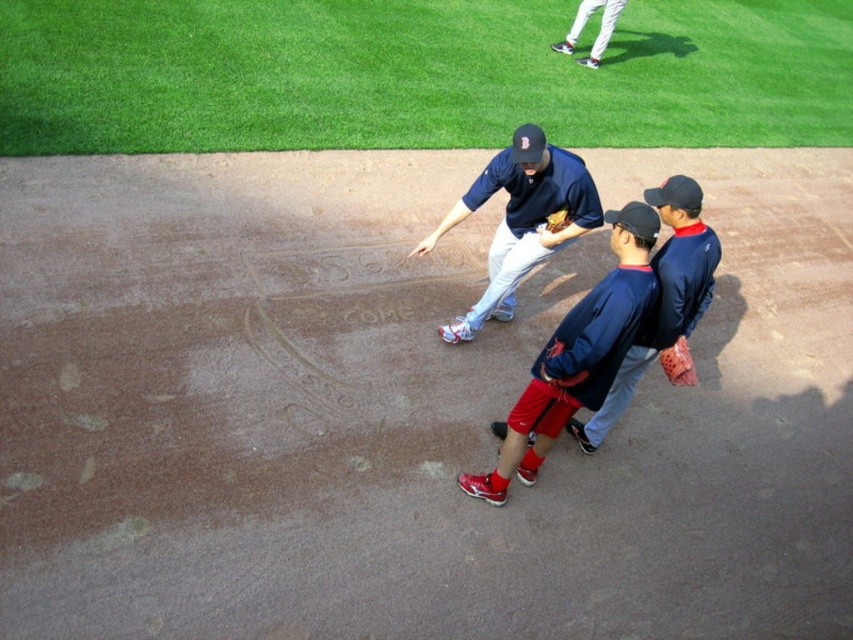
You are a coach observing the baseball field and notice two gloves on the ground. You need to determine which one is larger in height. Which glove is taller between the matte blue baseball glove at center and the orange leather glove at lower right?

The matte blue baseball glove at center is taller than the orange leather glove at lower right according to the description.

You are a photographer trying to capture a closeup of both the white baseball pants at upper center and the brown leather glove at center in the image. Given their sizes, which object should you zoom in on first to ensure it fits within your camera frame?

The white baseball pants at upper center is larger in size than the brown leather glove at center, so you should zoom in on the brown leather glove at center first to ensure it fits within the camera frame before adjusting for the larger pants.